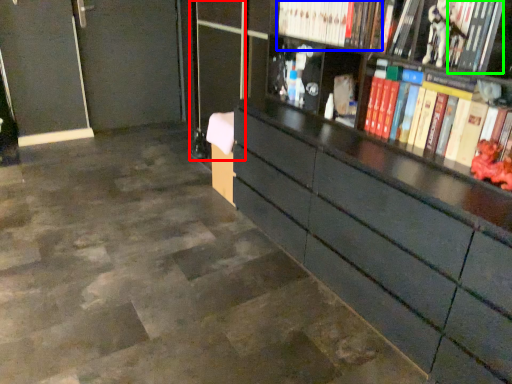
Question: Estimate the real-world distances between objects in this image. Which object is farther from glass door (highlighted by a red box), book (highlighted by a blue box) or book (highlighted by a green box)?

Choices:
 (A) book
 (B) book

Answer: (B)